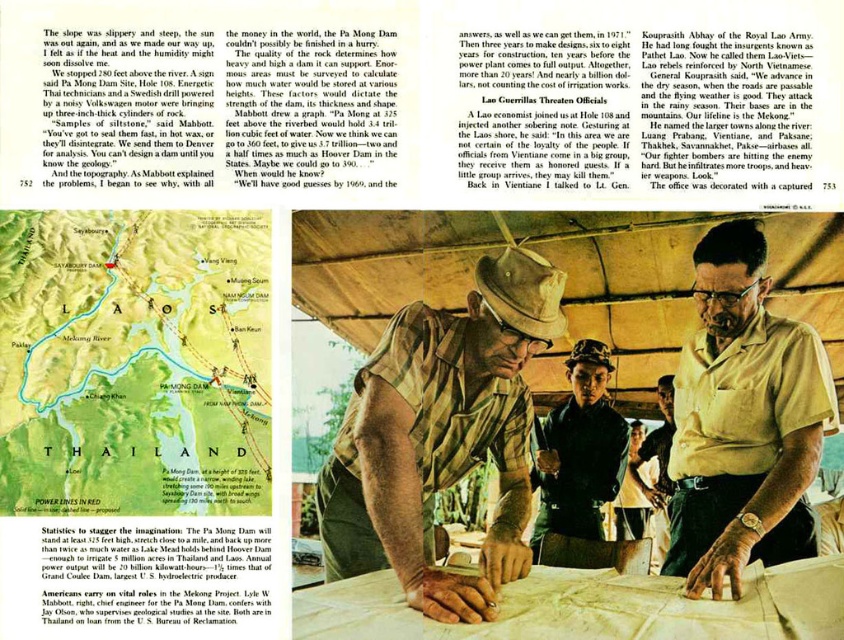
Question: Which object appears closest to the camera in this image?

Choices:
 (A) dark green uniform at center
 (B) khaki fabric shirt at center
 (C) green paper map at bottom left

Answer: (C)

Question: Which object is the closest to the dark green uniform at center?

Choices:
 (A) green paper map at bottom left
 (B) khaki fabric shirt at center

Answer: (B)

Question: Does green paper map at bottom left appear over tan shirt at center?

Choices:
 (A) no
 (B) yes

Answer: (B)

Question: Which object is the closest to the khaki fabric shirt at center?

Choices:
 (A) dark green uniform at center
 (B) green paper map at bottom left
 (C) tan shirt at center

Answer: (B)

Question: Can you confirm if khaki fabric shirt at center is smaller than tan shirt at center?

Choices:
 (A) yes
 (B) no

Answer: (B)

Question: Is green paper map at bottom left positioned behind khaki fabric shirt at center?

Choices:
 (A) no
 (B) yes

Answer: (A)